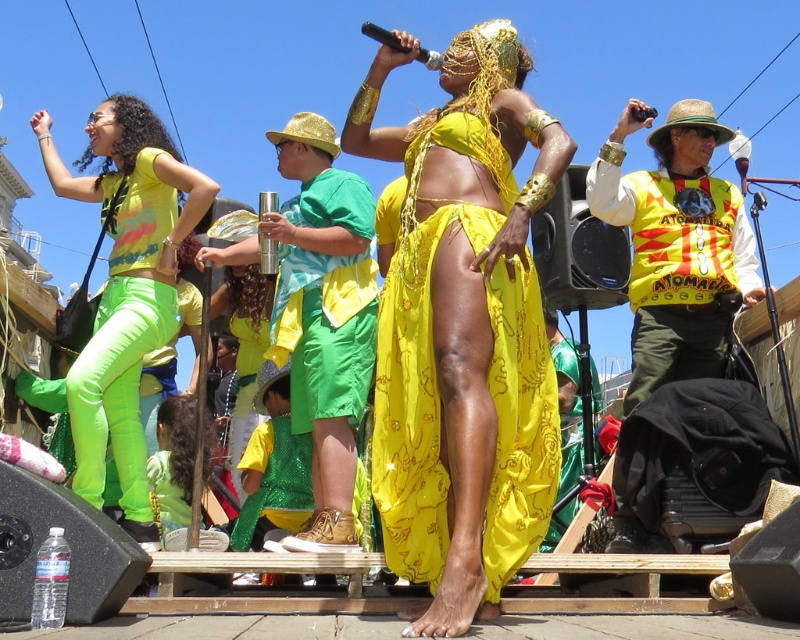
Question: Which object appears farthest from the camera in this image?

Choices:
 (A) green fabric at center
 (B) neon green pants at left
 (C) shiny yellow fabric at center

Answer: (A)

Question: Does shiny yellow fabric at center have a larger size compared to green fabric at center?

Choices:
 (A) yes
 (B) no

Answer: (A)

Question: Which of these objects is positioned farthest from the green fabric at center?

Choices:
 (A) shiny yellow fabric at center
 (B) neon green pants at left

Answer: (B)

Question: Can you confirm if shiny yellow fabric at center is positioned below green fabric at center?

Choices:
 (A) no
 (B) yes

Answer: (B)

Question: Is shiny yellow fabric at center above green fabric at center?

Choices:
 (A) no
 (B) yes

Answer: (A)

Question: Which of the following is the farthest from the observer?

Choices:
 (A) green fabric at center
 (B) shiny yellow fabric at center

Answer: (A)